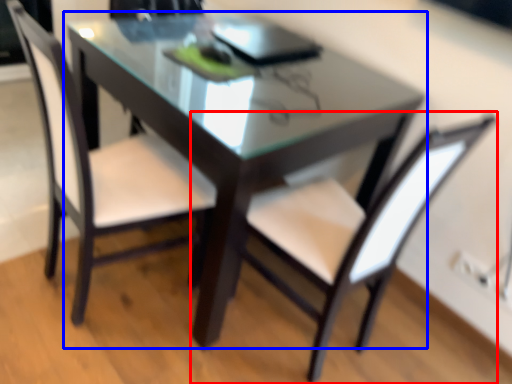
Question: Which of the following is the closest to the observer, chair (highlighted by a red box) or table (highlighted by a blue box)?

Choices:
 (A) chair
 (B) table

Answer: (A)